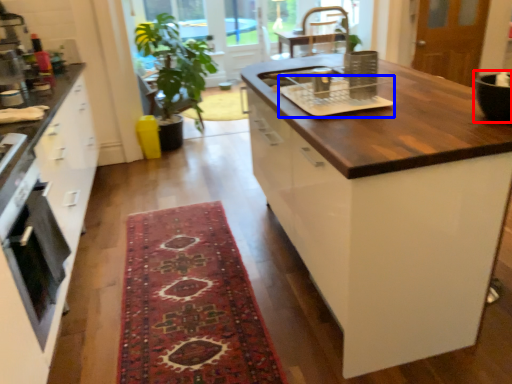
Question: Which point is further to the camera, appliance (highlighted by a red box) or appliance (highlighted by a blue box)?

Choices:
 (A) appliance
 (B) appliance

Answer: (B)